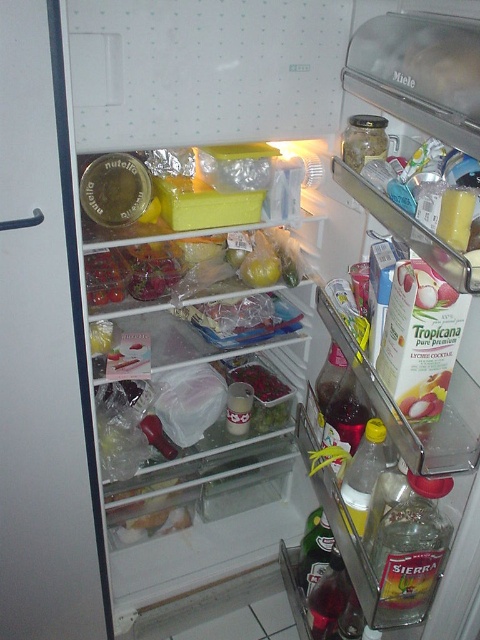
Does point (10, 296) come behind point (263, 371)?

No, it is not.

Is point (45, 44) positioned before point (280, 392)?

Yes.

The height and width of the screenshot is (640, 480). In order to click on matte plastic jar at left in this screenshot , I will do pos(44,353).